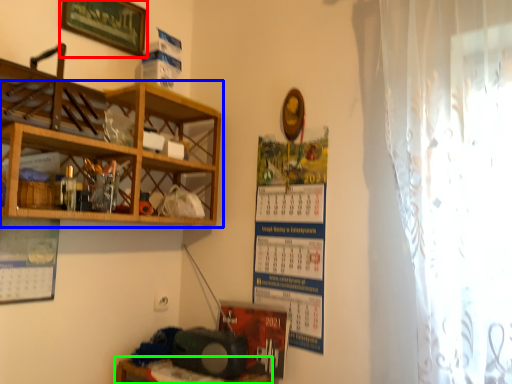
Question: Which is nearer to the picture frame (highlighted by a red box)? shelf (highlighted by a blue box) or table (highlighted by a green box).

Choices:
 (A) shelf
 (B) table

Answer: (A)